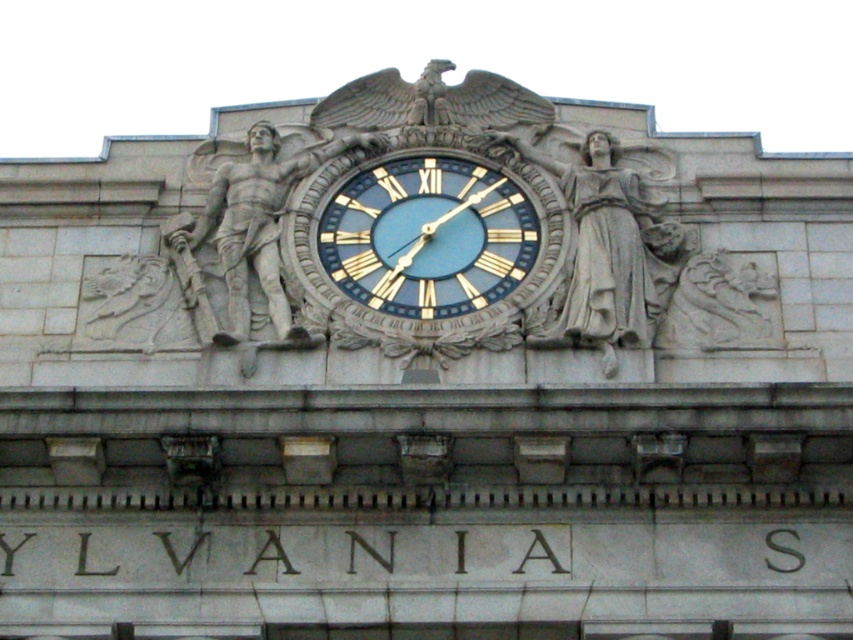
Question: Which point appears closest to the camera in this image?

Choices:
 (A) (405, 182)
 (B) (585, 292)
 (C) (247, 184)

Answer: (B)

Question: Which point is closer to the camera?

Choices:
 (A) (241, 224)
 (B) (543, 337)

Answer: (B)

Question: Is blue metallic clock at center in front of stone warrior at center?

Choices:
 (A) no
 (B) yes

Answer: (A)

Question: Which point is farther from the camera taking this photo?

Choices:
 (A) (584, 276)
 (B) (461, 212)
 (C) (239, 285)

Answer: (B)

Question: Is matte gray statue at center thinner than stone warrior at center?

Choices:
 (A) yes
 (B) no

Answer: (A)

Question: Observing the image, what is the correct spatial positioning of matte gray statue at center in reference to stone warrior at center?

Choices:
 (A) left
 (B) right

Answer: (B)